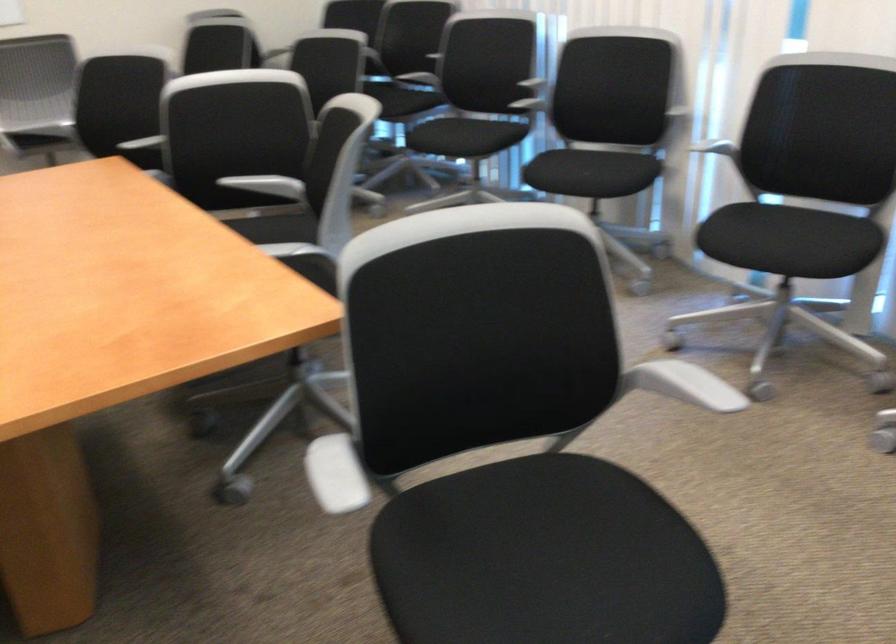
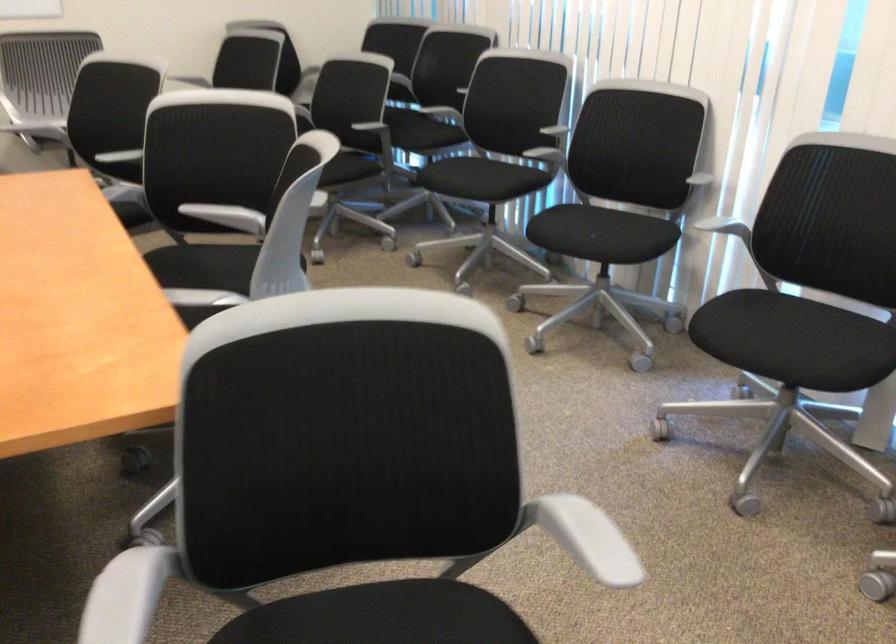
The point at (467, 138) is marked in the first image. Where is the corresponding point in the second image?

(480, 178)